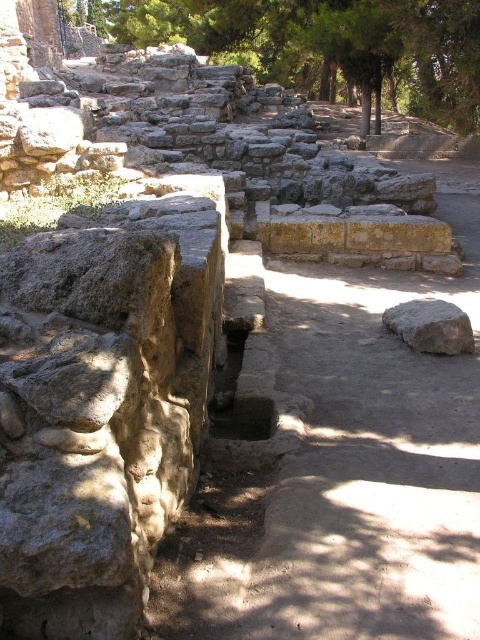
You are an archaeologist examining the site. You notice the green leafy tree at upper center and the smooth beige rock at center right. Which object occupies more horizontal space in the image?

The green leafy tree at upper center occupies more horizontal space than the smooth beige rock at center right because its width is larger.

You are standing at the archaeological site and want to take a photo of the green leafy tree at upper center. Your camera has a maximum focus range of 10 meters. Will you be able to focus on the tree?

The green leafy tree at upper center is 9.79 meters from viewer, so yes, the camera can focus on it since the distance is within the 10 meters range.

You are an archaeologist examining the site. You notice the green leafy tree at upper center and the smooth beige rock at center right. Which object is closer to your current position?

The green leafy tree at upper center is closer to your current position because it is further to the viewer than the smooth beige rock at center right.